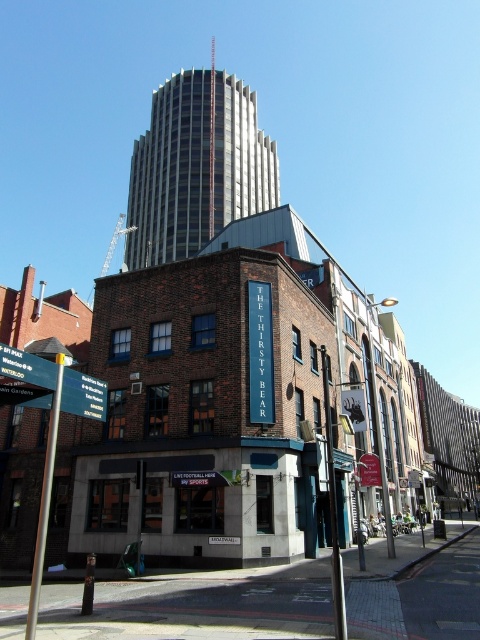
Consider the image. You are standing at the corner of the street and see the point marked at coordinates (196, 166). Which building does this point belong to?

The point marked at coordinates (196, 166) is on the gray concrete skyscraper at center.

You are a pedestrian standing at the intersection. You see the gray concrete skyscraper at center and the green plastic signpost at lower left. Which object is closer to you?

The green plastic signpost at lower left is behind the gray concrete skyscraper at center, so the skyscraper is closer to you.